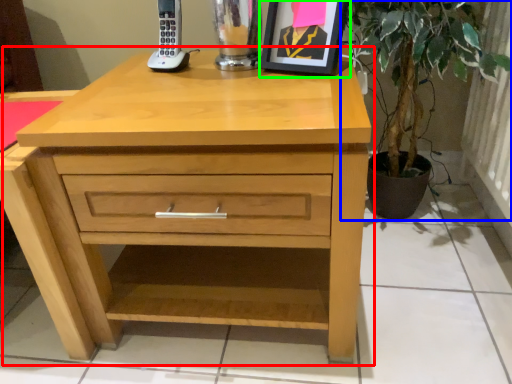
Question: Based on their relative distances, which object is nearer to chest of drawers (highlighted by a red box)? Choose from houseplant (highlighted by a blue box) and picture frame (highlighted by a green box).

Choices:
 (A) houseplant
 (B) picture frame

Answer: (B)